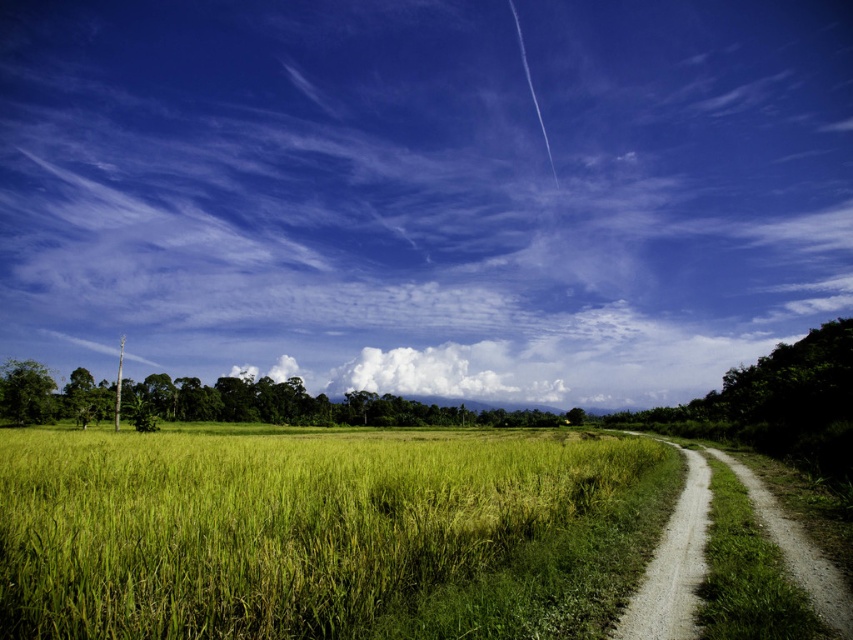
Who is more forward, (314, 452) or (693, 604)?

Point (693, 604) is in front.

Is point (56, 598) closer to camera compared to point (767, 509)?

Yes, point (56, 598) is closer to viewer.

The image size is (853, 640). Identify the location of green grassy rice field at center. (270, 524).

Is dirt/gravel path at right positioned in front of gravel path at right?

Yes, it is in front of gravel path at right.

Is dirt/gravel path at right below gravel path at right?

Actually, dirt/gravel path at right is above gravel path at right.

Is point (793, 572) positioned in front of point (688, 451)?

Yes, it is.

This screenshot has height=640, width=853. I want to click on dirt/gravel path at right, so click(672, 564).

Consider the image. Does green grassy rice field at center appear under gravel path at right?

Correct, green grassy rice field at center is located below gravel path at right.

Between point (469, 472) and point (679, 584), which one is positioned in front?

Point (679, 584)

Where is `green grassy rice field at center`? This screenshot has width=853, height=640. green grassy rice field at center is located at coordinates (270, 524).